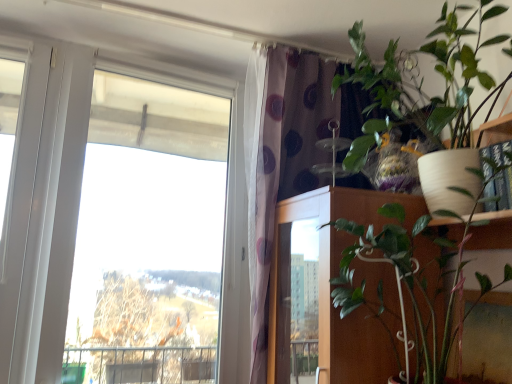
Identify the location of purple dotted curtain at upper center. (279, 158).

From the image's perspective, would you say wooden door at center is positioned over white matte pot at upper right?

No, from the image's perspective, wooden door at center is not above white matte pot at upper right.

Would you say wooden door at center is outside white matte pot at upper right?

Yes, wooden door at center is not within white matte pot at upper right.

Could you tell me if wooden door at center is turned towards white matte pot at upper right?

No, wooden door at center is not turned towards white matte pot at upper right.

Would you say wooden door at center is inside or outside purple dotted curtain at upper center?

wooden door at center lies within the bounds of purple dotted curtain at upper center.

Which of these two, wooden door at center or purple dotted curtain at upper center, is smaller?

wooden door at center.

From the image's perspective, between wooden door at center and purple dotted curtain at upper center, who is located below?

wooden door at center appears lower in the image.

How different are the orientations of wooden door at center and purple dotted curtain at upper center in degrees?

93.7 degrees.

Considering the sizes of transparent glass window at left and purple dotted curtain at upper center in the image, is transparent glass window at left bigger or smaller than purple dotted curtain at upper center?

In the image, transparent glass window at left appears to be smaller than purple dotted curtain at upper center.

From the image's perspective, is transparent glass window at left on purple dotted curtain at upper center?

Yes, from the image's perspective, transparent glass window at left is over purple dotted curtain at upper center.

Based on the photo, does transparent glass window at left turn towards purple dotted curtain at upper center?

No, transparent glass window at left is not facing towards purple dotted curtain at upper center.

Is purple dotted curtain at upper center bigger than wooden door at center?

Yes, purple dotted curtain at upper center is bigger than wooden door at center.

Is purple dotted curtain at upper center located outside wooden door at center?

That's correct, purple dotted curtain at upper center is outside of wooden door at center.

Is purple dotted curtain at upper center at the right side of wooden door at center?

No, purple dotted curtain at upper center is not to the right of wooden door at center.

Is purple dotted curtain at upper center aimed at wooden door at center?

Yes, purple dotted curtain at upper center is turned towards wooden door at center.

Which of these two, white matte pot at upper right or transparent glass window at left, stands taller?

transparent glass window at left.

From the image's perspective, is white matte pot at upper right under transparent glass window at left?

Yes.

From the picture: Which is more to the left, white matte pot at upper right or transparent glass window at left?

From the viewer's perspective, transparent glass window at left appears more on the left side.

Considering the points (460, 95) and (236, 266), which point is behind, point (460, 95) or point (236, 266)?

The point (236, 266) is behind.

Which object is positioned more to the left, purple dotted curtain at upper center or white matte pot at upper right?

purple dotted curtain at upper center is more to the left.

Locate an element on the screen. The width and height of the screenshot is (512, 384). houseplant located below the purple dotted curtain at upper center (from the image's perspective) is located at coordinates (431, 108).

Is purple dotted curtain at upper center wider or thinner than white matte pot at upper right?

In the image, purple dotted curtain at upper center appears to be more narrow than white matte pot at upper right.

Are purple dotted curtain at upper center and white matte pot at upper right located far from each other?

purple dotted curtain at upper center is near white matte pot at upper right, not far away.

Which object is positioned more to the right, transparent glass window at left or wooden door at center?

From the viewer's perspective, wooden door at center appears more on the right side.

Would you say transparent glass window at left is a long distance from wooden door at center?

That's not correct — transparent glass window at left is a little close to wooden door at center.

Which is closer to the camera, (242, 351) or (321, 232)?

Point (242, 351).

Considering the sizes of objects transparent glass window at left and wooden door at center in the image provided, who is thinner, transparent glass window at left or wooden door at center?

transparent glass window at left is thinner.

I want to click on door lying below the white matte pot at upper right (from the image's perspective), so click(295, 246).

The height and width of the screenshot is (384, 512). In order to click on door below the purple dotted curtain at upper center (from a real-world perspective) in this screenshot , I will do `click(295, 246)`.

Estimate the real-world distances between objects in this image. Which object is further from wooden door at center, transparent glass window at left or white matte pot at upper right?

Among the two, transparent glass window at left is located further to wooden door at center.

When comparing their distances from purple dotted curtain at upper center, does transparent glass window at left or wooden door at center seem further?

transparent glass window at left is further to purple dotted curtain at upper center.

Based on their spatial positions, is white matte pot at upper right or wooden door at center further from purple dotted curtain at upper center?

white matte pot at upper right lies further to purple dotted curtain at upper center than the other object.

Based on their spatial positions, is wooden door at center or transparent glass window at left closer to purple dotted curtain at upper center?

The object closer to purple dotted curtain at upper center is wooden door at center.

Considering their positions, is wooden door at center positioned closer to white matte pot at upper right than purple dotted curtain at upper center?

Among the two, wooden door at center is located nearer to white matte pot at upper right.

From the image, which object appears to be nearer to wooden door at center, purple dotted curtain at upper center or transparent glass window at left?

purple dotted curtain at upper center.

Looking at the image, which one is located closer to white matte pot at upper right, transparent glass window at left or wooden door at center?

wooden door at center lies closer to white matte pot at upper right than the other object.

Which object lies further to the anchor point purple dotted curtain at upper center, transparent glass window at left or white matte pot at upper right?

transparent glass window at left is positioned further to the anchor purple dotted curtain at upper center.

Where is `door located between white matte pot at upper right and purple dotted curtain at upper center in the depth direction`? This screenshot has height=384, width=512. door located between white matte pot at upper right and purple dotted curtain at upper center in the depth direction is located at coordinates (295, 246).

I want to click on curtain between transparent glass window at left and white matte pot at upper right in the horizontal direction, so click(x=279, y=158).

Locate an element on the screen. door between transparent glass window at left and white matte pot at upper right is located at coordinates (295, 246).

You are a GUI agent. You are given a task and a screenshot of the screen. Output one action in this format:
    pyautogui.click(x=<x>, y=<y>)
    Task: Click on the curtain between transparent glass window at left and wooden door at center in the horizontal direction
    This screenshot has height=384, width=512.
    Given the screenshot: What is the action you would take?
    tap(279, 158)